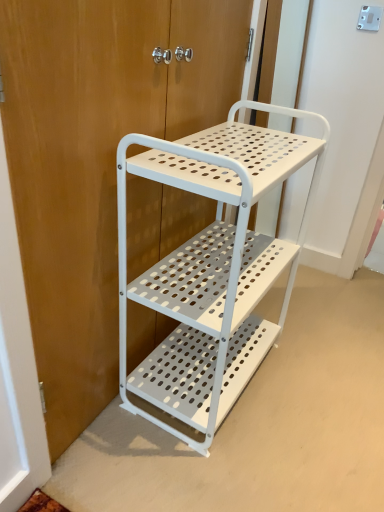
Question: Could white perforated metal cart at center be considered to be inside white metal door at center?

Choices:
 (A) no
 (B) yes

Answer: (A)

Question: Does white metal door at center come in front of white perforated metal cart at center?

Choices:
 (A) no
 (B) yes

Answer: (B)

Question: Is white metal door at center smaller than white perforated metal cart at center?

Choices:
 (A) yes
 (B) no

Answer: (A)

Question: Considering the relative sizes of white metal door at center and white perforated metal cart at center in the image provided, is white metal door at center bigger than white perforated metal cart at center?

Choices:
 (A) no
 (B) yes

Answer: (A)

Question: Is white metal door at center far away from white perforated metal cart at center?

Choices:
 (A) yes
 (B) no

Answer: (B)

Question: Is white metal door at center to the left of white perforated metal cart at center from the viewer's perspective?

Choices:
 (A) yes
 (B) no

Answer: (A)

Question: Considering the relative positions of white perforated metal cart at center and white metal door at center in the image provided, is white perforated metal cart at center in front of white metal door at center?

Choices:
 (A) no
 (B) yes

Answer: (A)

Question: Is white perforated metal cart at center taller than white metal door at center?

Choices:
 (A) yes
 (B) no

Answer: (B)

Question: Is white perforated metal cart at center aimed at white metal door at center?

Choices:
 (A) no
 (B) yes

Answer: (B)

Question: Considering the relative sizes of white perforated metal cart at center and white metal door at center in the image provided, is white perforated metal cart at center thinner than white metal door at center?

Choices:
 (A) no
 (B) yes

Answer: (A)

Question: Considering the relative sizes of white perforated metal cart at center and white metal door at center in the image provided, is white perforated metal cart at center shorter than white metal door at center?

Choices:
 (A) yes
 (B) no

Answer: (A)

Question: Are white perforated metal cart at center and white metal door at center located far from each other?

Choices:
 (A) no
 (B) yes

Answer: (A)

Question: Is white perforated metal cart at center to the left or to the right of white metal door at center in the image?

Choices:
 (A) left
 (B) right

Answer: (B)